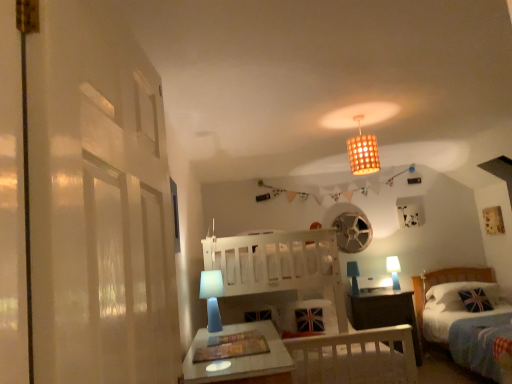
This screenshot has width=512, height=384. Find the location of `blue fabric lampshade at lower center, arranged as the first table lamp when viewed from the front`. blue fabric lampshade at lower center, arranged as the first table lamp when viewed from the front is located at coordinates (212, 297).

This screenshot has width=512, height=384. What do you see at coordinates (353, 276) in the screenshot?
I see `blue fabric table lamp at center, the second table lamp when ordered from left to right` at bounding box center [353, 276].

What is the approximate width of bamboo woven lampshade at upper center?

bamboo woven lampshade at upper center is 10.83 inches in width.

Find the location of a particular element. The width and height of the screenshot is (512, 384). white wooden bunk bed at center is located at coordinates (312, 305).

What do you see at coordinates (393, 270) in the screenshot? The height and width of the screenshot is (384, 512). I see `blue matte table lamp at right, acting as the 1th table lamp starting from the back` at bounding box center [393, 270].

Find the location of `blue fabric lampshade at lower center, arranged as the first table lamp when viewed from the front`. blue fabric lampshade at lower center, arranged as the first table lamp when viewed from the front is located at coordinates (212, 297).

Is union jack fabric pillow at lower right closer to camera compared to bamboo woven lampshade at upper center?

No, it is behind bamboo woven lampshade at upper center.

Is union jack fabric pillow at lower right turned away from bamboo woven lampshade at upper center?

No.

From the picture: Is union jack fabric pillow at lower right touching bamboo woven lampshade at upper center?

No, union jack fabric pillow at lower right is not making contact with bamboo woven lampshade at upper center.

From the image's perspective, which one is positioned higher, white wooden bunk bed at center or union jack fabric pillow at lower right?

white wooden bunk bed at center appears higher in the image.

Is white wooden bunk bed at center further to camera compared to union jack fabric pillow at lower right?

No, white wooden bunk bed at center is closer to the viewer.

Is white wooden bunk bed at center looking in the opposite direction of union jack fabric pillow at lower right?

white wooden bunk bed at center does not have its back to union jack fabric pillow at lower right.

From a real-world perspective, which object rests below the other?

From a 3D spatial view, white wooden bunk bed at center is below.

Can you confirm if blue fabric lampshade at lower center, which is counted as the first table lamp, starting from the left, is taller than white wooden bunk bed at center?

No.

Is point (219, 312) positioned after point (221, 270)?

That is False.

Image resolution: width=512 pixels, height=384 pixels. I want to click on bunk bed that appears below the blue fabric lampshade at lower center, which is counted as the first table lamp, starting from the left (from a real-world perspective), so click(312, 305).

From a real-world perspective, who is located higher, blue matte table lamp at right, the 3th table lamp from the front, or union jack fabric pillow at lower right?

blue matte table lamp at right, the 3th table lamp from the front, from a real-world perspective.

In the scene shown: Is blue matte table lamp at right, placed as the 3th table lamp when sorted from left to right, not near union jack fabric pillow at lower right?

blue matte table lamp at right, placed as the 3th table lamp when sorted from left to right, is actually quite close to union jack fabric pillow at lower right.

What's the angular difference between blue matte table lamp at right, positioned as the 1th table lamp in right-to-left order, and union jack fabric pillow at lower right's facing directions?

They differ by 2.11 degrees in their facing directions.

From the image's perspective, which one is positioned higher, blue matte table lamp at right, acting as the 1th table lamp starting from the back, or union jack fabric pillow at lower right?

blue matte table lamp at right, acting as the 1th table lamp starting from the back, is shown above in the image.

Could you tell me if bamboo woven lampshade at upper center is turned towards dark wood nightstand at lower right?

No, bamboo woven lampshade at upper center does not turn towards dark wood nightstand at lower right.

Does bamboo woven lampshade at upper center have a larger size compared to dark wood nightstand at lower right?

No.

From the image's perspective, is bamboo woven lampshade at upper center on top of dark wood nightstand at lower right?

Indeed, from the image's perspective, bamboo woven lampshade at upper center is shown above dark wood nightstand at lower right.

Which object is more forward, dark wood nightstand at lower right or white wooden bunk bed at center?

white wooden bunk bed at center is more forward.

Who is shorter, dark wood nightstand at lower right or white wooden bunk bed at center?

dark wood nightstand at lower right.

From the image's perspective, between blue fabric table lamp at center, which ranks as the 2th table lamp in back-to-front order, and dark wood nightstand at lower right, which one is located above?

From the image's view, blue fabric table lamp at center, which ranks as the 2th table lamp in back-to-front order, is above.

Is dark wood nightstand at lower right at the back of blue fabric table lamp at center, placed as the second table lamp when sorted from right to left?

No, blue fabric table lamp at center, placed as the second table lamp when sorted from right to left, is not facing away from dark wood nightstand at lower right.

Is blue fabric table lamp at center, which appears as the 2th table lamp when viewed from the front, taller or shorter than dark wood nightstand at lower right?

Clearly, blue fabric table lamp at center, which appears as the 2th table lamp when viewed from the front, is shorter compared to dark wood nightstand at lower right.

Is blue fabric table lamp at center, the second table lamp when ordered from left to right, far away from dark wood nightstand at lower right?

No, blue fabric table lamp at center, the second table lamp when ordered from left to right, is not far away from dark wood nightstand at lower right.

What are the coordinates of `pillow below the bamboo woven lampshade at upper center (from a real-world perspective)` in the screenshot? It's located at (460, 290).

Image resolution: width=512 pixels, height=384 pixels. What are the coordinates of `bunk bed lying in front of the union jack fabric pillow at lower right` in the screenshot? It's located at (312, 305).

Based on their spatial positions, is blue matte table lamp at right, acting as the 1th table lamp starting from the back, or union jack fabric pillow at lower right closer to white wooden bunk bed at center?

union jack fabric pillow at lower right lies closer to white wooden bunk bed at center than the other object.

Estimate the real-world distances between objects in this image. Which object is closer to dark wood nightstand at lower right, bamboo woven lampshade at upper center or white wooden bunk bed at center?

white wooden bunk bed at center is positioned closer to the anchor dark wood nightstand at lower right.

Which object lies nearer to the anchor point blue fabric table lamp at center, which ranks as the 2th table lamp in back-to-front order, white wooden bunk bed at center or blue fabric lampshade at lower center, arranged as the first table lamp when viewed from the front?

Among the two, white wooden bunk bed at center is located nearer to blue fabric table lamp at center, which ranks as the 2th table lamp in back-to-front order.

Based on their spatial positions, is blue fabric lampshade at lower center, arranged as the first table lamp when viewed from the front, or blue matte table lamp at right, placed as the 3th table lamp when sorted from left to right, further from white wooden bunk bed at center?

The object further to white wooden bunk bed at center is blue matte table lamp at right, placed as the 3th table lamp when sorted from left to right.

Which object lies further to the anchor point dark wood nightstand at lower right, blue fabric table lamp at center, placed as the second table lamp when sorted from right to left, or union jack fabric pillow at lower right?

union jack fabric pillow at lower right lies further to dark wood nightstand at lower right than the other object.

From the picture: Looking at the image, which one is located further to union jack fabric pillow at lower right, bamboo woven lampshade at upper center or blue fabric lampshade at lower center, placed as the 3th table lamp when sorted from back to front?

blue fabric lampshade at lower center, placed as the 3th table lamp when sorted from back to front, lies further to union jack fabric pillow at lower right than the other object.

Looking at the image, which one is located closer to blue fabric table lamp at center, the second table lamp when ordered from left to right, blue fabric lampshade at lower center, which is counted as the first table lamp, starting from the left, or bamboo woven lampshade at upper center?

bamboo woven lampshade at upper center is positioned closer to the anchor blue fabric table lamp at center, the second table lamp when ordered from left to right.

Based on their spatial positions, is blue fabric lampshade at lower center, which is counted as the first table lamp, starting from the left, or dark wood nightstand at lower right closer to white wooden bunk bed at center?

blue fabric lampshade at lower center, which is counted as the first table lamp, starting from the left, lies closer to white wooden bunk bed at center than the other object.

Where is `bunk bed positioned between blue fabric lampshade at lower center, arranged as the first table lamp when viewed from the front, and blue matte table lamp at right, acting as the 1th table lamp starting from the back, from near to far`? bunk bed positioned between blue fabric lampshade at lower center, arranged as the first table lamp when viewed from the front, and blue matte table lamp at right, acting as the 1th table lamp starting from the back, from near to far is located at coordinates (312, 305).

Find the location of a particular element. bunk bed between blue fabric lampshade at lower center, arranged as the first table lamp when viewed from the front, and blue fabric table lamp at center, which ranks as the 2th table lamp in back-to-front order, in the front-back direction is located at coordinates (312, 305).

At what (x,y) coordinates should I click in order to perform the action: click on nightstand between bamboo woven lampshade at upper center and blue matte table lamp at right, placed as the 3th table lamp when sorted from left to right, in the front-back direction. Please return your answer as a coordinate pair (x, y). The width and height of the screenshot is (512, 384). Looking at the image, I should click on (384, 312).

Identify the location of nightstand between bamboo woven lampshade at upper center and blue fabric table lamp at center, which appears as the 2th table lamp when viewed from the front, along the z-axis. The height and width of the screenshot is (384, 512). (384, 312).